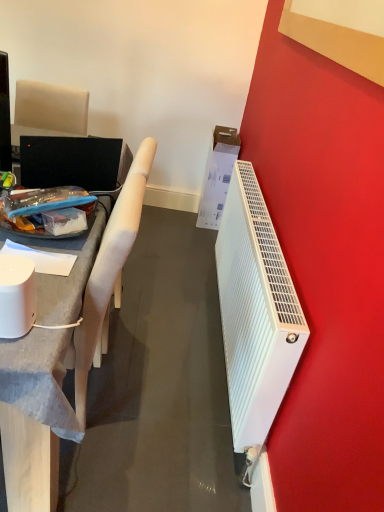
Question: From the image's perspective, relative to matte gray desk at left, is white glossy smart speaker at left above or below?

Choices:
 (A) above
 (B) below

Answer: (B)

Question: Looking at the image, does white glossy smart speaker at left seem bigger or smaller compared to matte gray desk at left?

Choices:
 (A) big
 (B) small

Answer: (B)

Question: Estimate the real-world distances between objects in this image. Which object is farther from the matte gray desk at left?

Choices:
 (A) white cardboard box at right
 (B) white plastic radiator at right
 (C) white fabric chair at left
 (D) white glossy smart speaker at left

Answer: (A)

Question: Which is farther from the white plastic radiator at right?

Choices:
 (A) white cardboard box at right
 (B) matte gray desk at left
 (C) white fabric chair at left
 (D) white glossy smart speaker at left

Answer: (A)